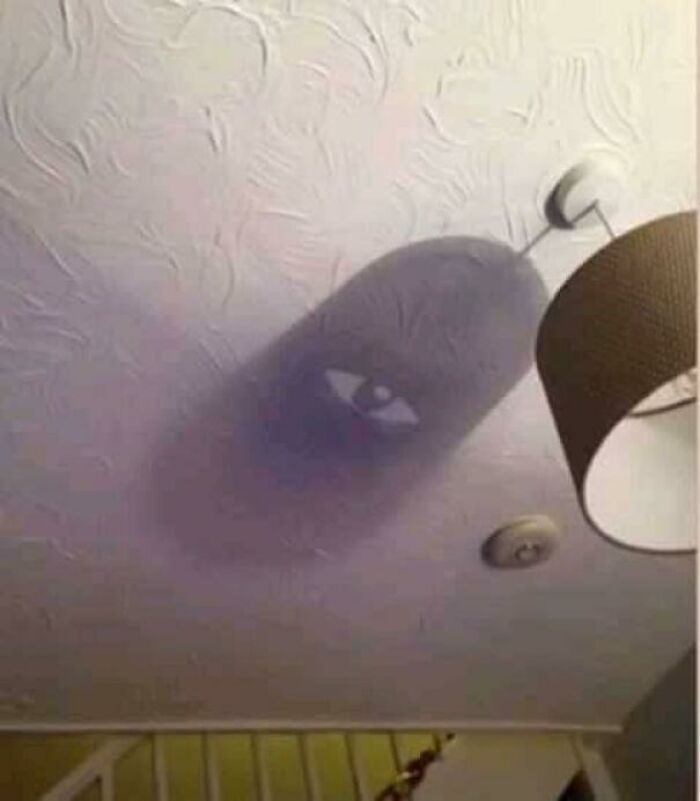
Where is `stairs`? The image size is (700, 801). stairs is located at coordinates (416, 767).